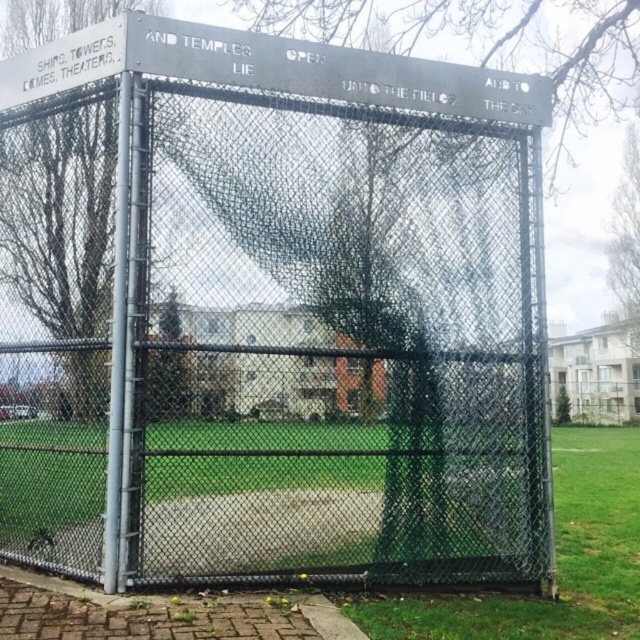
Question: Is green grass at lower center to the left of green grass at lower right from the viewer's perspective?

Choices:
 (A) no
 (B) yes

Answer: (B)

Question: Does green grass at lower center appear on the right side of green grass at lower right?

Choices:
 (A) no
 (B) yes

Answer: (A)

Question: Considering the relative positions of green grass at lower center and green grass at lower right in the image provided, where is green grass at lower center located with respect to green grass at lower right?

Choices:
 (A) below
 (B) above

Answer: (B)

Question: Which of the following is the farthest from the observer?

Choices:
 (A) [612, 529]
 (B) [600, 435]

Answer: (B)

Question: Which point is farther to the camera?

Choices:
 (A) green grass at lower right
 (B) green grass at lower center

Answer: (A)